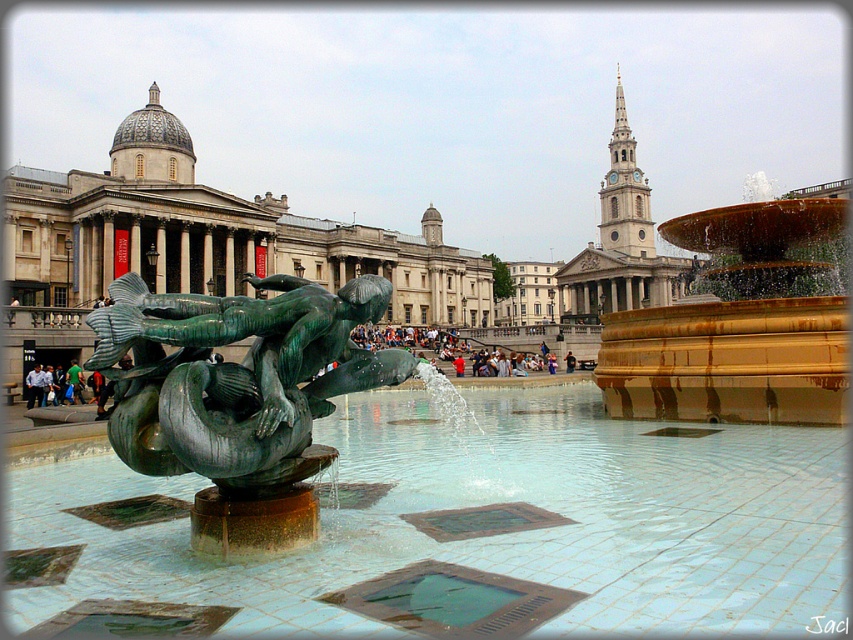
Who is lower down, green stone square at center or white shirt at center?

green stone square at center is lower down.

Can you confirm if green stone square at center is bigger than white shirt at center?

Incorrect, green stone square at center is not larger than white shirt at center.

Between point (105, 516) and point (38, 404), which one is positioned behind?

The point (38, 404) is behind.

Locate an element on the screen. green stone square at center is located at coordinates [132, 512].

Can you confirm if brass/bronze square at center is shorter than green stone square at center?

In fact, brass/bronze square at center may be taller than green stone square at center.

Is brass/bronze square at center to the left of green stone square at center from the viewer's perspective?

No, brass/bronze square at center is not to the left of green stone square at center.

You are a GUI agent. You are given a task and a screenshot of the screen. Output one action in this format:
    pyautogui.click(x=<x>, y=<y>)
    Task: Click on the brass/bronze square at center
    The image size is (853, 640).
    Given the screenshot: What is the action you would take?
    pyautogui.click(x=483, y=520)

Between clear water at fountain center and bronze textured sculpture at center, which one appears on the left side from the viewer's perspective?

bronze textured sculpture at center

Between point (718, 529) and point (326, 307), which one is positioned in front?

Point (718, 529)

In order to click on clear water at fountain center in this screenshot , I will do `click(497, 534)`.